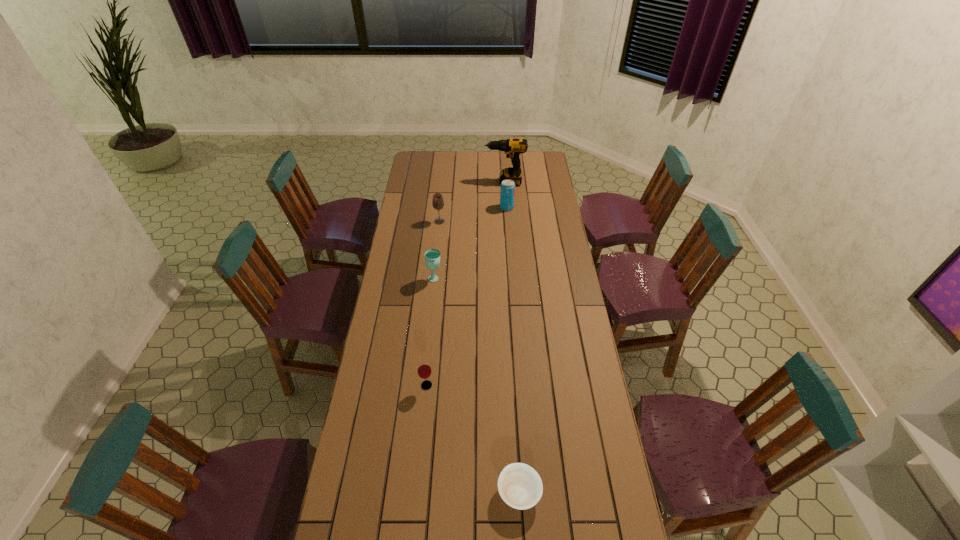
You are a GUI agent. You are given a task and a screenshot of the screen. Output one action in this format:
    pyautogui.click(x=<x>, y=<y>)
    Task: Click on the free spot between the shortest glass and the soda can
    This screenshot has width=960, height=540.
    Given the screenshot: What is the action you would take?
    pyautogui.click(x=467, y=296)

Find the location of a particular element. The height and width of the screenshot is (540, 960). blank region between the farthest glass and the shortest glass is located at coordinates 433,303.

This screenshot has height=540, width=960. What are the coordinates of `empty location between the second shortest object and the nearest object` in the screenshot? It's located at (473, 438).

Identify the location of blank region between the tallest object and the farthest glass. The image size is (960, 540). (472, 202).

Locate an element on the screen. This screenshot has height=540, width=960. vacant region between the bowl and the farthest glass is located at coordinates (479, 357).

Where is `empty location between the fourth farthest object and the second nearest object`? This screenshot has width=960, height=540. empty location between the fourth farthest object and the second nearest object is located at coordinates (431, 332).

Image resolution: width=960 pixels, height=540 pixels. Identify the location of unoccupied position between the fourth farthest object and the second nearest object. (431, 332).

Locate an element on the screen. The height and width of the screenshot is (540, 960). free space between the nearest object and the fourth nearest object is located at coordinates (479, 357).

Identify the location of vacant area that lies between the shortest object and the second shortest object. (473, 438).

Locate an element on the screen. object that ranks as the fifth closest to the drill is located at coordinates (519, 485).